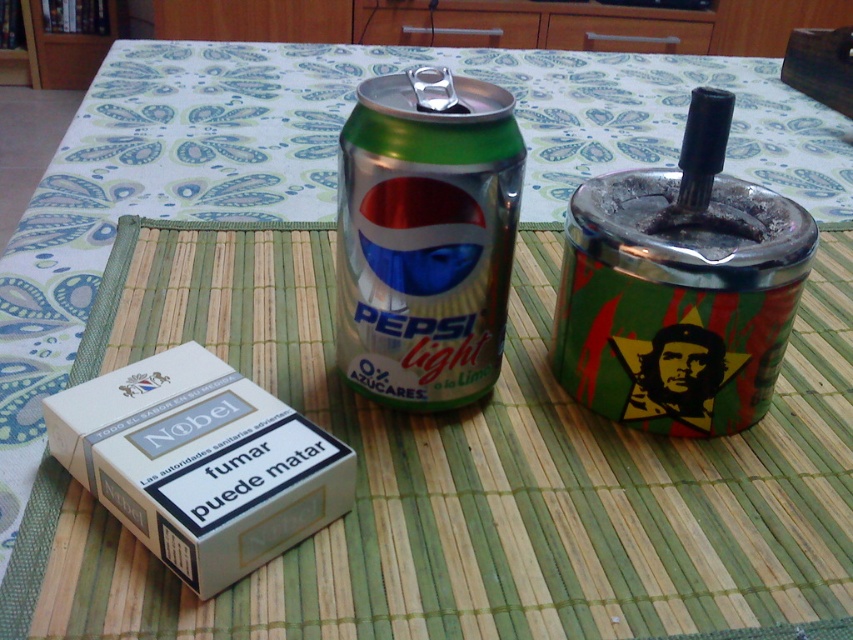
You are a waiter at a restaurant and you need to place a new menu on the table. The menu is 10 cm tall. There is space between the metallic silver can at center and the metallic ashtray at right. Is there enough vertical space to place the menu there?

The metallic ashtray at right is below the metallic silver can at center. The vertical space between them is not specified, so it is uncertain if there is enough room for the 10 cm tall menu. Check the actual distance before placing it.

What is the position of the metallic ashtray at right relative to the can of Pepsi Light?

The metallic ashtray at right is located at point (679, 288) relative to the can of Pepsi Light.

You are a smoker who wants to place your cigarette on the table. The metallic ashtray at right is taller than the white matte cigarette box at lower left. Which object should you place your cigarette on to avoid it touching the table?

You should place your cigarette on the metallic ashtray at right because it is taller than the white matte cigarette box at lower left, so it will keep the cigarette elevated off the table.